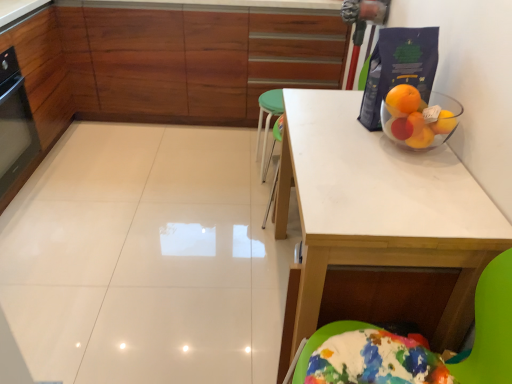
Question: Considering the positions of wooden cabinet at upper center and white matte table at upper right in the image, is wooden cabinet at upper center taller or shorter than white matte table at upper right?

Choices:
 (A) short
 (B) tall

Answer: (B)

Question: Is wooden cabinet at upper center bigger or smaller than white matte table at upper right?

Choices:
 (A) small
 (B) big

Answer: (B)

Question: Which is nearer to the white matte table at upper right?

Choices:
 (A) black glass oven at left
 (B) wooden cabinet at upper center

Answer: (B)

Question: Based on their relative distances, which object is farther from the black glass oven at left?

Choices:
 (A) white matte table at upper right
 (B) wooden cabinet at upper center

Answer: (A)